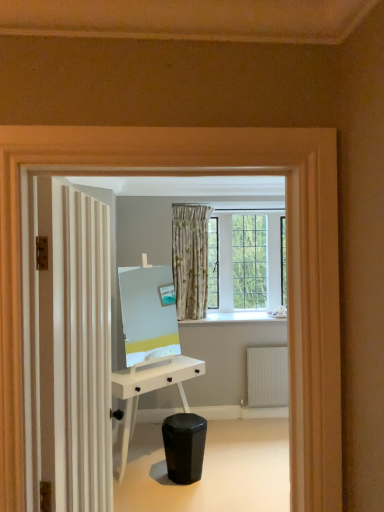
The width and height of the screenshot is (384, 512). In order to click on free point to the right of white matte desk at center in this screenshot , I will do `click(252, 468)`.